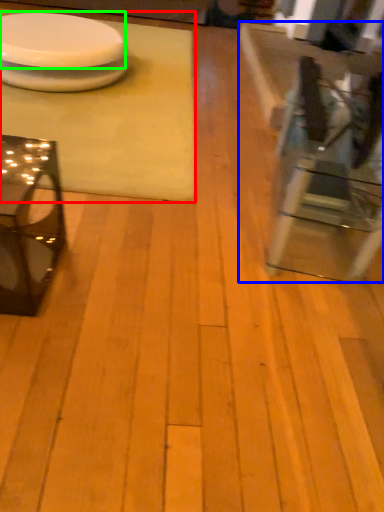
Question: Which object is positioned farthest from table (highlighted by a red box)? Select from table (highlighted by a blue box) and platter (highlighted by a green box).

Choices:
 (A) table
 (B) platter

Answer: (A)